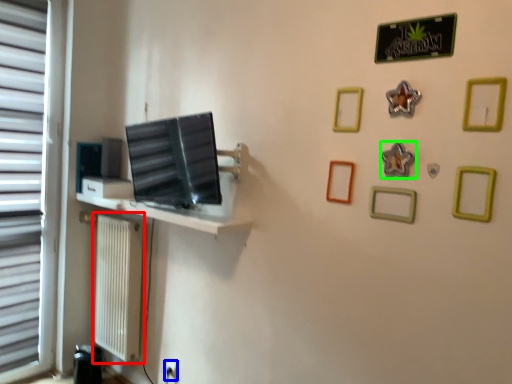
Question: Which object is positioned closest to radiator (highlighted by a red box)? Select from electric outlet (highlighted by a blue box) and picture frame (highlighted by a green box).

Choices:
 (A) electric outlet
 (B) picture frame

Answer: (A)